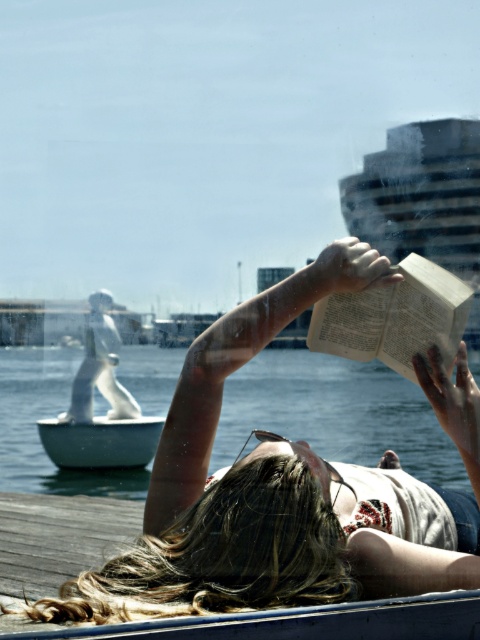
Question: Estimate the real-world distances between objects in this image. Which object is farther from the smooth white hair at upper center?

Choices:
 (A) white matte boat at lower left
 (B) white paper book at upper right
 (C) clear water at center

Answer: (A)

Question: From the image, what is the correct spatial relationship of clear water at center in relation to white paper book at upper right?

Choices:
 (A) above
 (B) below

Answer: (B)

Question: Can you confirm if smooth white hair at upper center is wider than clear water at center?

Choices:
 (A) yes
 (B) no

Answer: (B)

Question: Which point is farther from the camera taking this photo?

Choices:
 (A) (437, 280)
 (B) (175, 362)
 (C) (254, 321)
 (D) (122, 451)

Answer: (B)

Question: Considering the relative positions of smooth white hair at upper center and clear water at center in the image provided, where is smooth white hair at upper center located with respect to clear water at center?

Choices:
 (A) left
 (B) right

Answer: (B)

Question: Among these points, which one is nearest to the camera?

Choices:
 (A) (331, 326)
 (B) (140, 422)
 (C) (437, 483)
 (D) (409, 483)

Answer: (A)